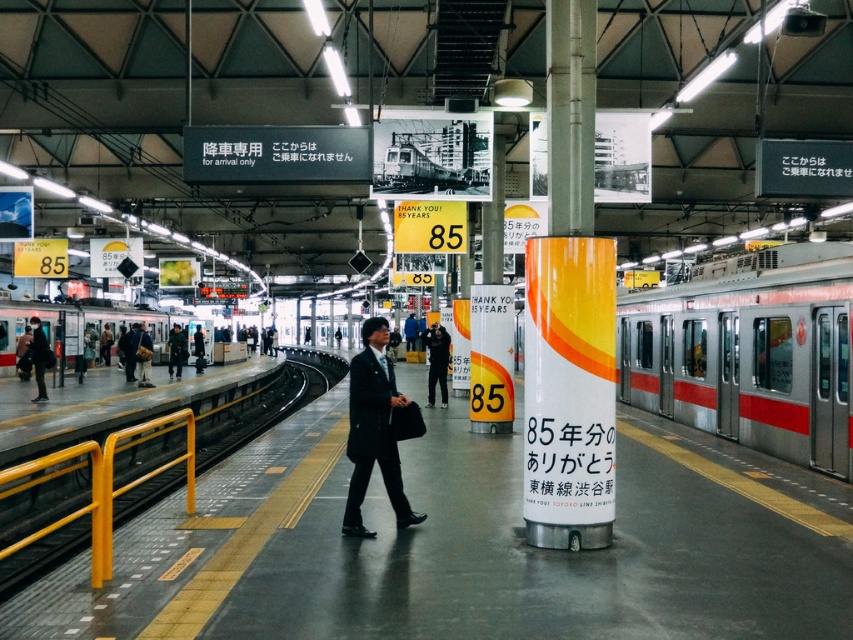
You are standing at the train station platform described in the scene. There is a black suit located at point (x=373, y=429). If you want to pick up the black suit, which direction should you move relative to the cylindrical pillar with the orange and white advertisement?

The black suit at center is located at point (x=373, y=429). Since the cylindrical pillar with the orange and white advertisement is in the foreground, you should move towards the center of the platform to reach the black suit.

You are standing on the platform at the train station. You see a silver metallic train at right and a black suit at center. Which object is positioned more to the right side of the platform?

The silver metallic train at right is positioned more to the right side of the platform than the black suit at center.

You are standing on the train station platform and see two points marked on the pillar with coordinates point (718, 392) and point (596, 269). Which point is closer to you?

Point (596, 269) is closer to you because it is less further to the camera than point (718, 392).